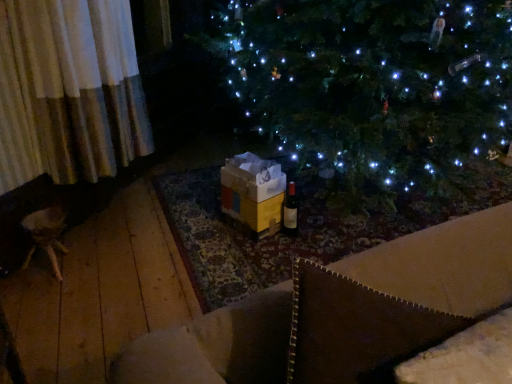
Describe the element at coordinates (69, 91) in the screenshot. I see `white textured curtain at left` at that location.

Measure the distance between point (39, 82) and camera.

1.84 meters.

In order to face white textured curtain at left, should I rotate leftwards or rightwards?

To face it directly, rotate left by 16.454 degrees.

Where is `white textured curtain at left`? The image size is (512, 384). white textured curtain at left is located at coordinates (69, 91).

Locate an element on the screen. This screenshot has width=512, height=384. white textured curtain at left is located at coordinates (69, 91).